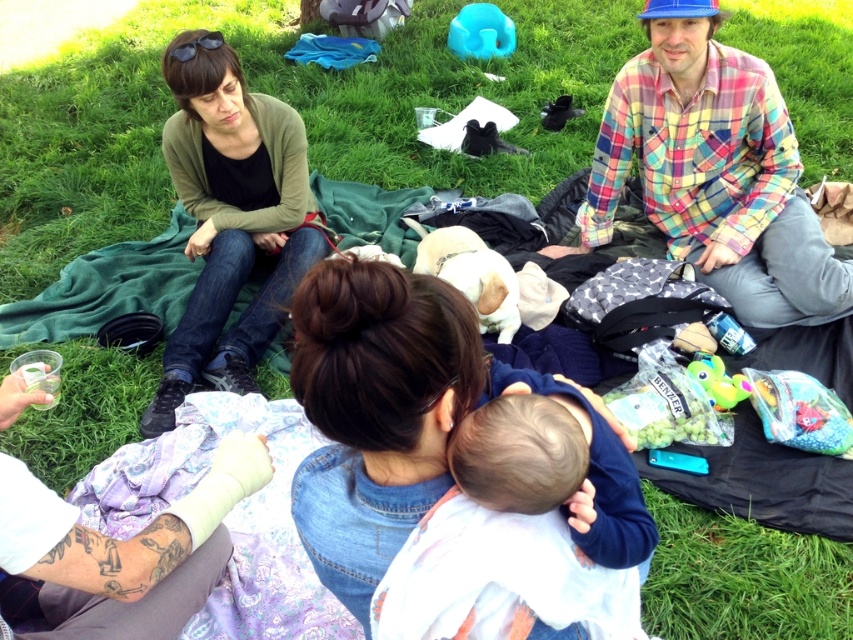
Between brown denim jacket at center and white bandaged arm at lower left, which one appears on the left side from the viewer's perspective?

white bandaged arm at lower left is more to the left.

Who is positioned more to the right, brown denim jacket at center or white bandaged arm at lower left?

brown denim jacket at center is more to the right.

Is point (640, 499) in front of point (67, 605)?

Yes, point (640, 499) is in front of point (67, 605).

You are a GUI agent. You are given a task and a screenshot of the screen. Output one action in this format:
    pyautogui.click(x=<x>, y=<y>)
    Task: Click on the brown denim jacket at center
    
    Given the screenshot: What is the action you would take?
    pyautogui.click(x=412, y=420)

Can you confirm if brown denim jacket at center is bigger than green matte cardigan at upper left?

Actually, brown denim jacket at center might be smaller than green matte cardigan at upper left.

Is brown denim jacket at center closer to the viewer compared to green matte cardigan at upper left?

Yes, it is in front of green matte cardigan at upper left.

Is point (323, 403) closer to camera compared to point (263, 184)?

Yes, it is.

You are a GUI agent. You are given a task and a screenshot of the screen. Output one action in this format:
    pyautogui.click(x=<x>, y=<y>)
    Task: Click on the brown denim jacket at center
    The width and height of the screenshot is (853, 640).
    Given the screenshot: What is the action you would take?
    pyautogui.click(x=412, y=420)

Measure the distance from multicolored plaid shirt at upper right to green matte cardigan at upper left.

The distance of multicolored plaid shirt at upper right from green matte cardigan at upper left is 1.36 meters.

Is point (724, 104) farther from viewer compared to point (163, 408)?

Yes, point (724, 104) is behind point (163, 408).

Is point (730, 170) positioned after point (223, 268)?

Yes, point (730, 170) is behind point (223, 268).

At what (x,y) coordinates should I click in order to perform the action: click on multicolored plaid shirt at upper right. Please return your answer as a coordinate pair (x, y). Looking at the image, I should click on (712, 170).